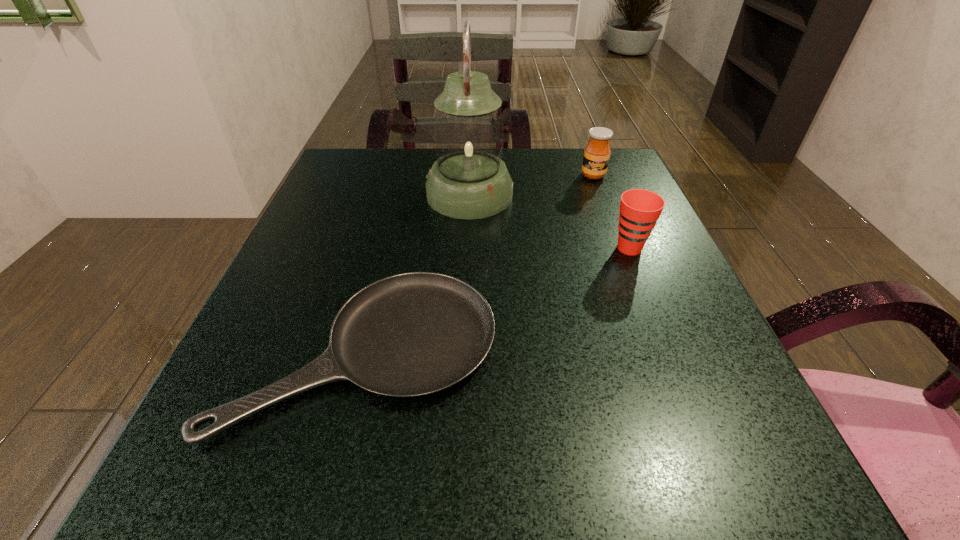
Locate an element on the screen. The width and height of the screenshot is (960, 540). free space between the third farthest object and the frying pan is located at coordinates (496, 300).

Find the location of a particular element. This screenshot has width=960, height=540. empty location between the cup and the honey is located at coordinates (612, 212).

Where is `the third closest object to the lantern`? This screenshot has height=540, width=960. the third closest object to the lantern is located at coordinates (412, 334).

Choose which object is the third nearest neighbor to the shortest object. Please provide its 2D coordinates. Your answer should be formatted as a tuple, i.e. [(x, y)], where the tuple contains the x and y coordinates of a point satisfying the conditions above.

[(597, 152)]

The width and height of the screenshot is (960, 540). Find the location of `free spot that satisfies the following two spatial constraints: 1. on the front-facing side of the second nearest object; 2. on the right side of the honey`. free spot that satisfies the following two spatial constraints: 1. on the front-facing side of the second nearest object; 2. on the right side of the honey is located at coordinates (621, 248).